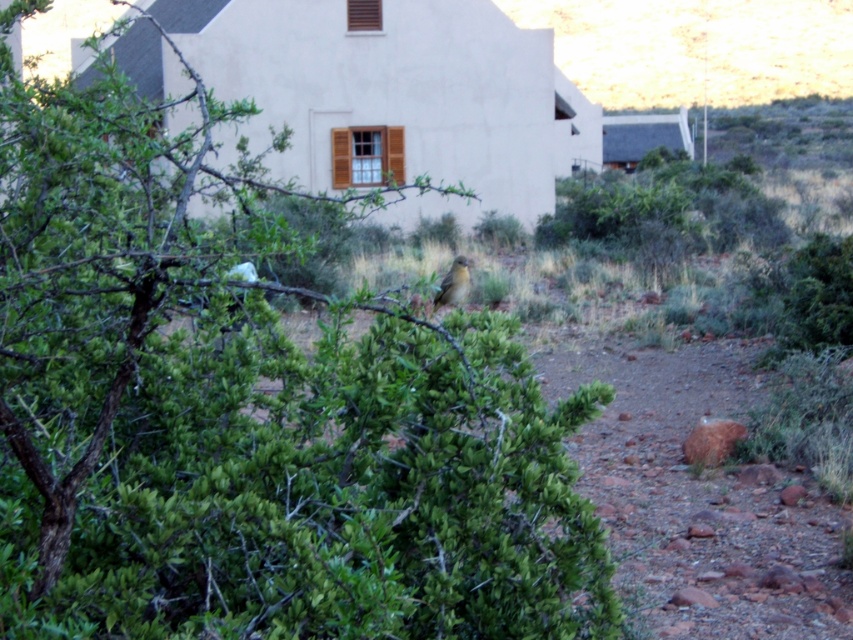
You are a photographer trying to capture the brown feathered bird at center without the green leafy bush at center blocking the view. Is it possible to adjust your position to achieve this?

The green leafy bush at center is closer to the viewer than the brown feathered bird at center, so you cannot adjust your position to avoid the bush blocking the view of the bird.

In the scene shown: You are standing in the outdoor scene and want to determine which of the two points, point (24, 205) or point (454, 259), is closer to you. Based on the scene description, which point is nearer?

Point (24, 205) is closer to the viewer than point (454, 259).